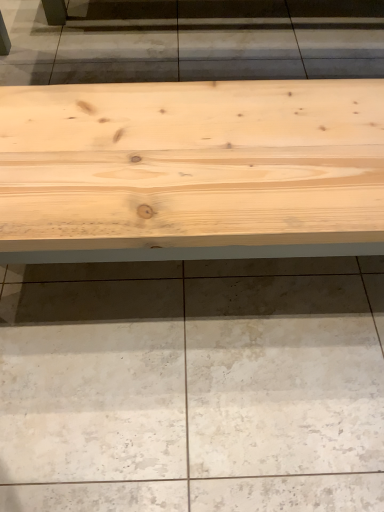
Question: Would you say natural wood bench at center is part of natural wood table at center's contents?

Choices:
 (A) no
 (B) yes

Answer: (A)

Question: Is natural wood table at center to the left of natural wood bench at center from the viewer's perspective?

Choices:
 (A) no
 (B) yes

Answer: (B)

Question: Is natural wood table at center oriented towards natural wood bench at center?

Choices:
 (A) no
 (B) yes

Answer: (A)

Question: Does natural wood table at center lie behind natural wood bench at center?

Choices:
 (A) no
 (B) yes

Answer: (A)

Question: Is natural wood table at center turned away from natural wood bench at center?

Choices:
 (A) yes
 (B) no

Answer: (B)

Question: Are natural wood table at center and natural wood bench at center far apart?

Choices:
 (A) yes
 (B) no

Answer: (B)

Question: From the image's perspective, is natural wood bench at center under natural wood table at center?

Choices:
 (A) yes
 (B) no

Answer: (A)

Question: Is natural wood bench at center positioned beyond the bounds of natural wood table at center?

Choices:
 (A) yes
 (B) no

Answer: (A)

Question: Can you confirm if natural wood bench at center is shorter than natural wood table at center?

Choices:
 (A) no
 (B) yes

Answer: (B)

Question: Does natural wood bench at center appear on the left side of natural wood table at center?

Choices:
 (A) yes
 (B) no

Answer: (B)

Question: Is natural wood bench at center thinner than natural wood table at center?

Choices:
 (A) no
 (B) yes

Answer: (B)

Question: Would you say natural wood bench at center contains natural wood table at center?

Choices:
 (A) no
 (B) yes

Answer: (A)

Question: In terms of width, does natural wood bench at center look wider or thinner when compared to natural wood table at center?

Choices:
 (A) wide
 (B) thin

Answer: (B)